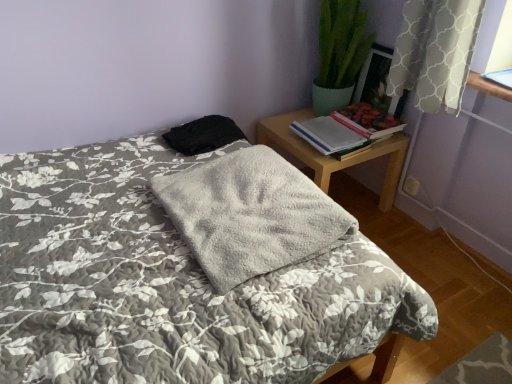
Locate an element on the screen. hardcover book at upper right, which is the first book from right to left is located at coordinates (367, 120).

Where is `wooden nightstand at upper right`? This screenshot has height=384, width=512. wooden nightstand at upper right is located at coordinates (332, 158).

The width and height of the screenshot is (512, 384). I want to click on gray fluffy blanket at center, so tap(251, 215).

Considering the relative sizes of gray fluffy blanket at center and white paper book at right, the first book positioned from the left, in the image provided, is gray fluffy blanket at center taller than white paper book at right, the first book positioned from the left,?

Yes, gray fluffy blanket at center is taller than white paper book at right, the first book positioned from the left.

Is gray fluffy blanket at center next to white paper book at right, the 2th book from the right?

A: No.

Locate an element on the screen. This screenshot has height=384, width=512. the 2nd book directly beneath the gray fluffy blanket at center (from a real-world perspective) is located at coordinates (327, 135).

Is gray fluffy blanket at center turned away from white paper book at right, the 2th book from the right?

gray fluffy blanket at center is not turned away from white paper book at right, the 2th book from the right.

Does white paper book at right, the first book positioned from the left, have a smaller size compared to black fabric at upper center?

Indeed, white paper book at right, the first book positioned from the left, has a smaller size compared to black fabric at upper center.

From the image's perspective, does white paper book at right, the 2th book from the right, appear lower than black fabric at upper center?

No.

Which of these two, white paper book at right, the first book positioned from the left, or black fabric at upper center, is wider?

black fabric at upper center.

Is fluffy gray blanket at center to the left of white paper book at right, the 2th book from the right, from the viewer's perspective?

Yes, fluffy gray blanket at center is to the left of white paper book at right, the 2th book from the right.

Does point (70, 154) lie in front of point (323, 121)?

Yes.

Looking at this image, considering the relative sizes of fluffy gray blanket at center and white paper book at right, the 2th book from the right, in the image provided, is fluffy gray blanket at center wider than white paper book at right, the 2th book from the right,?

Correct, the width of fluffy gray blanket at center exceeds that of white paper book at right, the 2th book from the right.

You are a GUI agent. You are given a task and a screenshot of the screen. Output one action in this format:
    pyautogui.click(x=<x>, y=<y>)
    Task: Click on the bed below the white paper book at right, the 2th book from the right (from the image's perspective)
    
    Given the screenshot: What is the action you would take?
    pyautogui.click(x=169, y=284)

From a real-world perspective, between white paper book at right, the first book positioned from the left, and hardcover book at upper right, which is the first book from right to left, who is vertically higher?

hardcover book at upper right, which is the first book from right to left, from a real-world perspective.

Could you measure the distance between white paper book at right, the first book positioned from the left, and hardcover book at upper right, which is the 2th book from left to right?

4.74 inches.

Is white paper book at right, the 2th book from the right, oriented towards hardcover book at upper right, which is the 2th book from left to right?

No, white paper book at right, the 2th book from the right, is not oriented towards hardcover book at upper right, which is the 2th book from left to right.

Which is behind, point (303, 128) or point (368, 125)?

The point (303, 128) is behind.

Can you tell me how much black fabric at upper center and hardcover book at upper right, which is the 2th book from left to right, differ in facing direction?

black fabric at upper center and hardcover book at upper right, which is the 2th book from left to right, are facing 103 degrees away from each other.

From the picture: Would you say black fabric at upper center is inside or outside hardcover book at upper right, which is the first book from right to left?

black fabric at upper center is outside hardcover book at upper right, which is the first book from right to left.

From the image's perspective, would you say black fabric at upper center is shown under hardcover book at upper right, which is the first book from right to left?

Yes, from the image's perspective, black fabric at upper center is below hardcover book at upper right, which is the first book from right to left.

Are black fabric at upper center and hardcover book at upper right, which is the first book from right to left, beside each other?

No, black fabric at upper center is not with hardcover book at upper right, which is the first book from right to left.

From a real-world perspective, is white paper book at right, the first book positioned from the left, positioned above or below gray fluffy blanket at center?

white paper book at right, the first book positioned from the left, is below gray fluffy blanket at center.

Is white paper book at right, the first book positioned from the left, aimed at gray fluffy blanket at center?

No, white paper book at right, the first book positioned from the left, does not turn towards gray fluffy blanket at center.

Based on the photo, can you confirm if white paper book at right, the first book positioned from the left, is wider than gray fluffy blanket at center?

No.

From the picture: Could you measure the distance between white paper book at right, the first book positioned from the left, and gray fluffy blanket at center?

The distance of white paper book at right, the first book positioned from the left, from gray fluffy blanket at center is 24.15 inches.

From their relative heights in the image, would you say black fabric at upper center is taller or shorter than white paper book at right, the first book positioned from the left?

Clearly, black fabric at upper center is taller compared to white paper book at right, the first book positioned from the left.

Based on the photo, does black fabric at upper center turn towards white paper book at right, the first book positioned from the left?

Yes, black fabric at upper center is facing white paper book at right, the first book positioned from the left.

Is black fabric at upper center located outside white paper book at right, the 2th book from the right?

Yes, black fabric at upper center is outside of white paper book at right, the 2th book from the right.

Could you measure the distance between black fabric at upper center and white paper book at right, the first book positioned from the left?

A distance of 45.58 centimeters exists between black fabric at upper center and white paper book at right, the first book positioned from the left.

Locate an element on the screen. The width and height of the screenshot is (512, 384). blanket that is in front of the white paper book at right, the first book positioned from the left is located at coordinates (251, 215).

From a real-world perspective, starting from the black fabric at upper center, which book is the 2nd one below it? Please provide its 2D coordinates.

[(327, 135)]

Looking at the image, which one is located closer to wooden nightstand at upper right, white paper book at right, the 2th book from the right, or fluffy gray blanket at center?

The object closer to wooden nightstand at upper right is white paper book at right, the 2th book from the right.

When comparing their distances from hardcover book at upper right, which is the first book from right to left, does white paper book at right, the first book positioned from the left, or wooden nightstand at upper right seem closer?

white paper book at right, the first book positioned from the left.

Looking at the image, which one is located closer to wooden nightstand at upper right, gray fluffy blanket at center or black fabric at upper center?

black fabric at upper center lies closer to wooden nightstand at upper right than the other object.

When comparing their distances from hardcover book at upper right, which is the first book from right to left, does black fabric at upper center or wooden nightstand at upper right seem closer?

wooden nightstand at upper right is positioned closer to the anchor hardcover book at upper right, which is the first book from right to left.

Based on their spatial positions, is fluffy gray blanket at center or black fabric at upper center closer to wooden nightstand at upper right?

black fabric at upper center is closer to wooden nightstand at upper right.

Based on their spatial positions, is black fabric at upper center or wooden nightstand at upper right closer to gray fluffy blanket at center?

black fabric at upper center is positioned closer to the anchor gray fluffy blanket at center.

When comparing their distances from white paper book at right, the 2th book from the right, does hardcover book at upper right, which is the 2th book from left to right, or black fabric at upper center seem closer?

The object closer to white paper book at right, the 2th book from the right, is hardcover book at upper right, which is the 2th book from left to right.

Estimate the real-world distances between objects in this image. Which object is further from white paper book at right, the 2th book from the right, black fabric at upper center or hardcover book at upper right, which is the first book from right to left?

black fabric at upper center is further to white paper book at right, the 2th book from the right.

You are a GUI agent. You are given a task and a screenshot of the screen. Output one action in this format:
    pyautogui.click(x=<x>, y=<y>)
    Task: Click on the nightstand between white paper book at right, the first book positioned from the left, and hardcover book at upper right, which is the first book from right to left, in the horizontal direction
    The height and width of the screenshot is (384, 512).
    Given the screenshot: What is the action you would take?
    pyautogui.click(x=332, y=158)

You are a GUI agent. You are given a task and a screenshot of the screen. Output one action in this format:
    pyautogui.click(x=<x>, y=<y>)
    Task: Click on the nightstand between gray fluffy blanket at center and white paper book at right, the first book positioned from the left, in the front-back direction
    Image resolution: width=512 pixels, height=384 pixels.
    Given the screenshot: What is the action you would take?
    pyautogui.click(x=332, y=158)

This screenshot has height=384, width=512. Find the location of `nightstand positioned between fluffy gray blanket at center and hardcover book at upper right, which is the 2th book from left to right, from near to far`. nightstand positioned between fluffy gray blanket at center and hardcover book at upper right, which is the 2th book from left to right, from near to far is located at coordinates (332, 158).

Locate an element on the screen. This screenshot has width=512, height=384. book between black fabric at upper center and wooden nightstand at upper right from left to right is located at coordinates (327, 135).